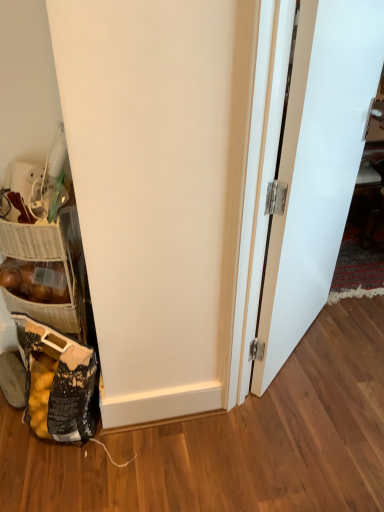
Question: Is the depth of black plastic bag at lower left greater than that of woven brown basket at lower left?

Choices:
 (A) yes
 (B) no

Answer: (B)

Question: From the image's perspective, is black plastic bag at lower left beneath woven brown basket at lower left?

Choices:
 (A) no
 (B) yes

Answer: (B)

Question: From a real-world perspective, is black plastic bag at lower left on woven brown basket at lower left?

Choices:
 (A) yes
 (B) no

Answer: (B)

Question: Can you see black plastic bag at lower left touching woven brown basket at lower left?

Choices:
 (A) no
 (B) yes

Answer: (A)

Question: From the image's perspective, is black plastic bag at lower left on woven brown basket at lower left?

Choices:
 (A) no
 (B) yes

Answer: (A)

Question: From a real-world perspective, is white matte door at right physically located above or below woven brown basket at lower left?

Choices:
 (A) below
 (B) above

Answer: (B)

Question: Based on their positions, is white matte door at right located to the left or right of woven brown basket at lower left?

Choices:
 (A) left
 (B) right

Answer: (B)

Question: In terms of width, does white matte door at right look wider or thinner when compared to woven brown basket at lower left?

Choices:
 (A) thin
 (B) wide

Answer: (A)

Question: Is point (342, 135) positioned closer to the camera than point (24, 283)?

Choices:
 (A) closer
 (B) farther

Answer: (A)

Question: Which is correct: woven brown basket at lower left is inside white matte door at right, or outside of it?

Choices:
 (A) inside
 (B) outside

Answer: (B)

Question: In terms of height, does woven brown basket at lower left look taller or shorter compared to white matte door at right?

Choices:
 (A) short
 (B) tall

Answer: (A)

Question: From a real-world perspective, is woven brown basket at lower left above or below white matte door at right?

Choices:
 (A) above
 (B) below

Answer: (B)

Question: In the image, is woven brown basket at lower left positioned in front of or behind white matte door at right?

Choices:
 (A) front
 (B) behind

Answer: (B)

Question: Does point (54, 301) appear closer or farther from the camera than point (62, 350)?

Choices:
 (A) farther
 (B) closer

Answer: (A)

Question: Considering the relative positions of woven brown basket at lower left and black plastic bag at lower left in the image provided, is woven brown basket at lower left to the left or to the right of black plastic bag at lower left?

Choices:
 (A) left
 (B) right

Answer: (A)